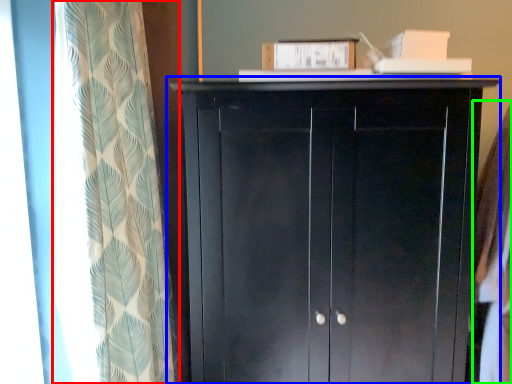
Question: Which object is the closest to the curtain (highlighted by a red box)? Choose among these: cupboard (highlighted by a blue box) or clothing (highlighted by a green box).

Choices:
 (A) cupboard
 (B) clothing

Answer: (A)